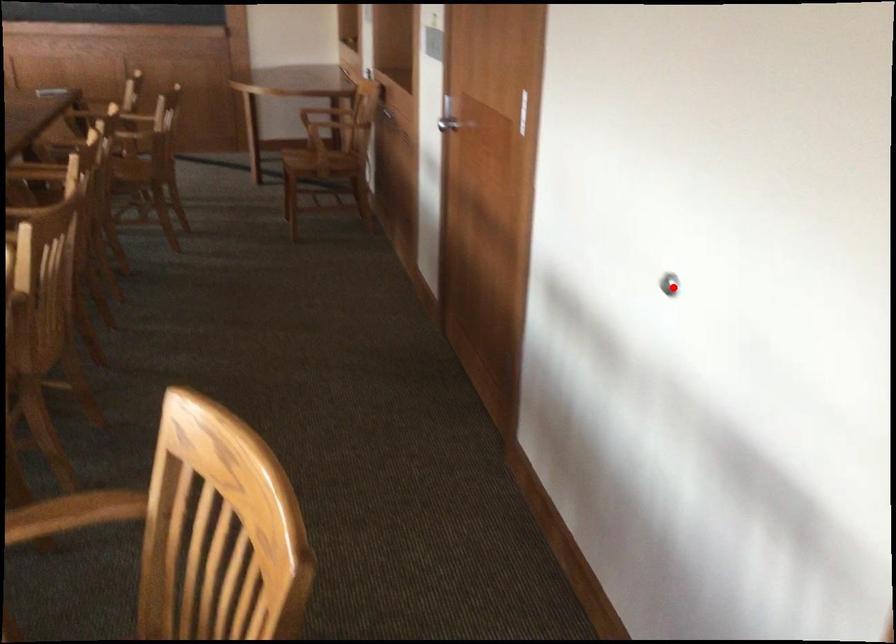
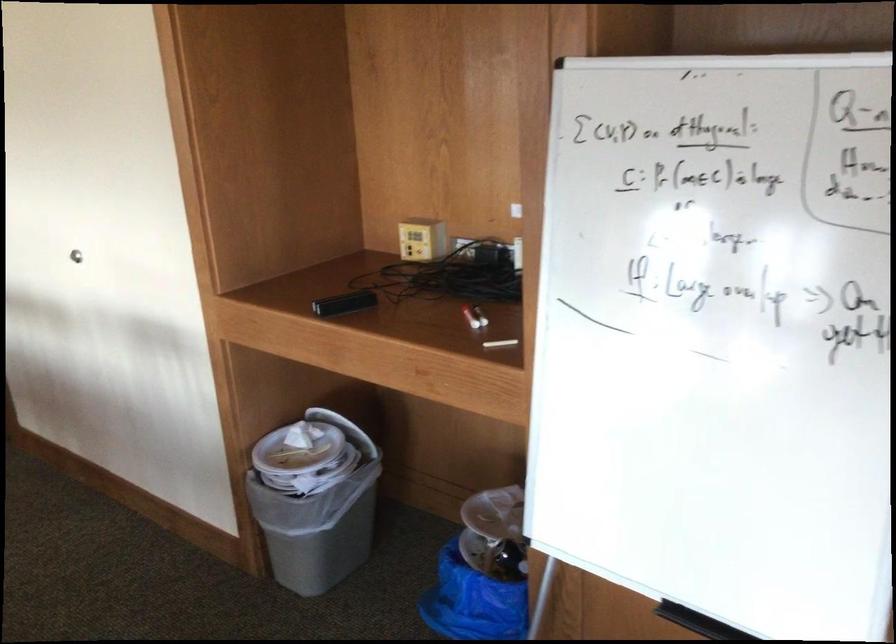
Question: I am providing you with two images of the same scene from different viewpoints. A red point is shown in image1. For the corresponding object point in image2, is it positioned nearer or farther from the camera?

Choices:
 (A) Nearer
 (B) Farther

Answer: (B)